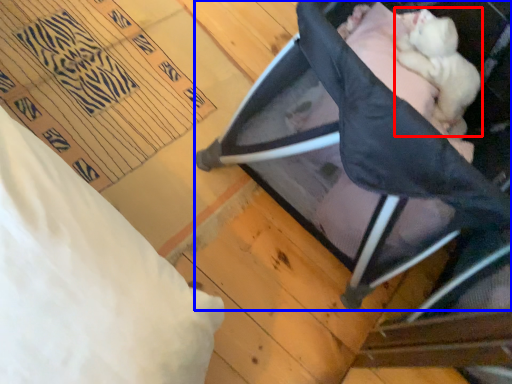
Question: Which object is further to the camera taking this photo, newborn (highlighted by a red box) or furniture (highlighted by a blue box)?

Choices:
 (A) newborn
 (B) furniture

Answer: (A)